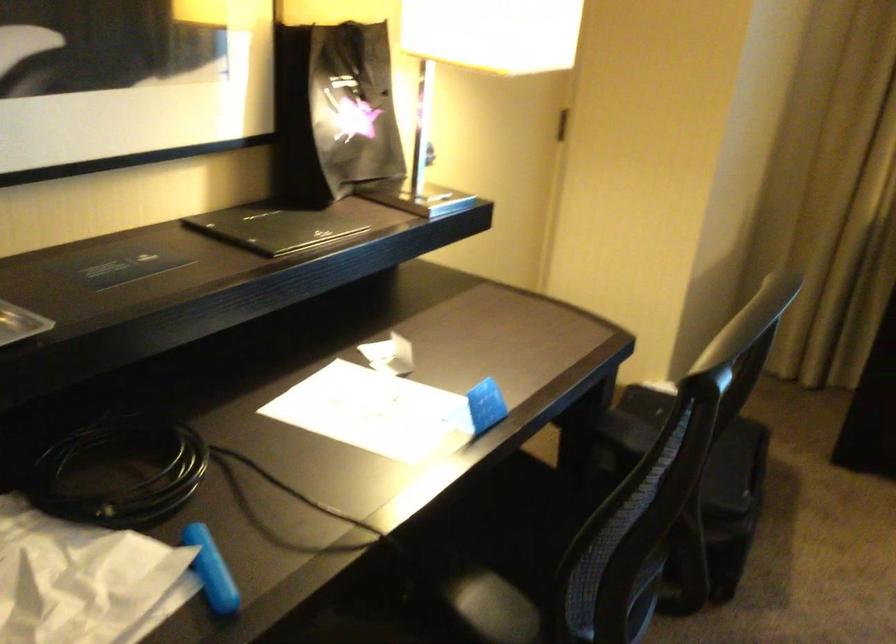
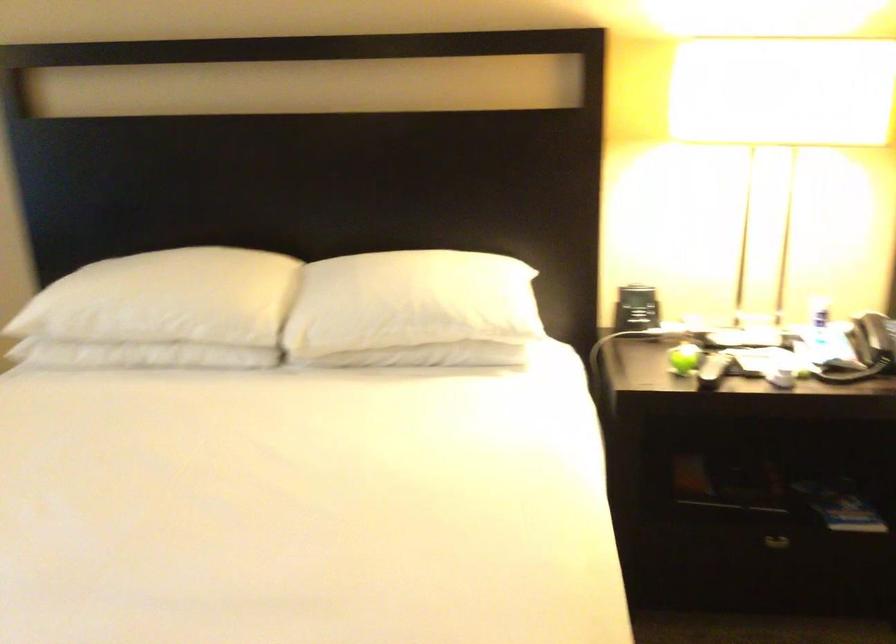
How did the camera likely rotate?

The camera rotated toward right-down.